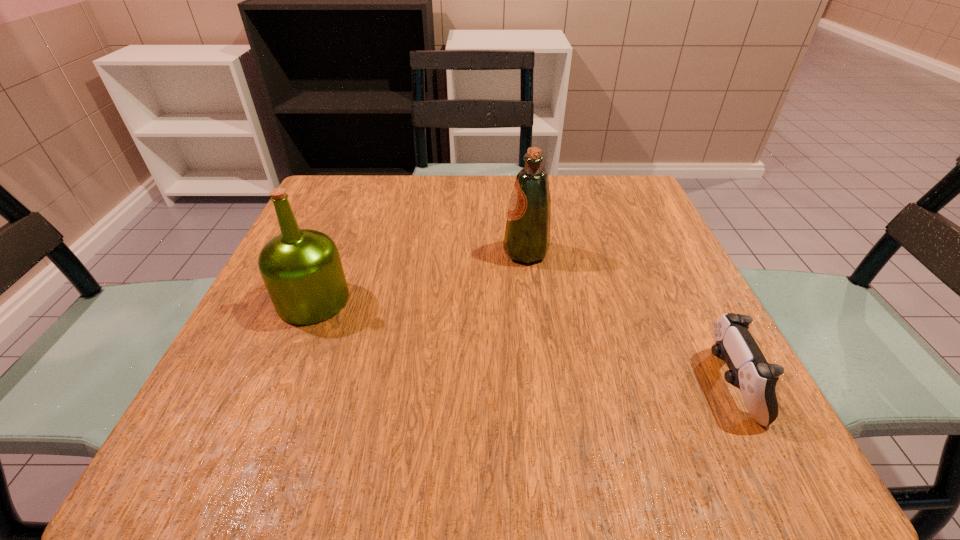
You are a GUI agent. You are given a task and a screenshot of the screen. Output one action in this format:
    pyautogui.click(x=<x>, y=<y>)
    Task: Click on the free region located on the front-facing side of the shortest object
    
    Given the screenshot: What is the action you would take?
    pyautogui.click(x=453, y=384)

Image resolution: width=960 pixels, height=540 pixels. I want to click on vacant position located on the front-facing side of the shortest object, so click(x=657, y=384).

Identify the location of vacant space located 0.340m on the front-facing side of the shortest object. (486, 384).

Where is `object situated at the near edge`? object situated at the near edge is located at coordinates (749, 371).

Identify the location of object at the left edge. (301, 268).

I want to click on object that is positioned at the right edge, so click(749, 371).

The width and height of the screenshot is (960, 540). I want to click on object located in the near right corner section of the desktop, so click(749, 371).

This screenshot has width=960, height=540. In the image, there is a desktop. Identify the location of vacant area at the far edge. (438, 214).

The image size is (960, 540). In the image, there is a desktop. In order to click on free space at the near edge in this screenshot , I will do `click(619, 437)`.

Locate an element on the screen. The height and width of the screenshot is (540, 960). vacant space at the left edge is located at coordinates (252, 412).